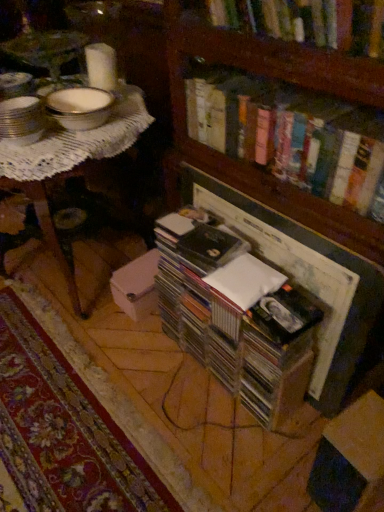
The width and height of the screenshot is (384, 512). What are the coordinates of `wooden bookcase at center` in the screenshot? It's located at (260, 169).

Describe the element at coordinates (349, 455) in the screenshot. The height and width of the screenshot is (512, 384). I see `cardboard box at lower right` at that location.

This screenshot has height=512, width=384. In order to click on cardboard box at lower right in this screenshot , I will do `click(349, 455)`.

Describe the element at coordinates (293, 136) in the screenshot. I see `hardcover books at upper center, marked as the 2th book in a bottom-to-top arrangement` at that location.

At what (x,y) coordinates should I click in order to perform the action: click on wooden bookcase at center. Please return your answer as a coordinate pair (x, y). The image size is (384, 512). Looking at the image, I should click on (260, 169).

Considering the relative sizes of wooden bookcase at center and metallic silver bowls at upper left in the image provided, is wooden bookcase at center wider than metallic silver bowls at upper left?

Yes.

Find the location of a particular element. The height and width of the screenshot is (512, 384). tableware on the left of the wooden bookcase at center is located at coordinates (22, 120).

Who is taller, wooden bookcase at center or metallic silver bowls at upper left?

wooden bookcase at center.

Considering the sizes of objects hardcover books at upper center, marked as the 2th book in a bottom-to-top arrangement, and white lace table at upper left in the image provided, who is smaller, hardcover books at upper center, marked as the 2th book in a bottom-to-top arrangement, or white lace table at upper left?

hardcover books at upper center, marked as the 2th book in a bottom-to-top arrangement, is smaller.

Would you say white lace table at upper left is part of hardcover books at upper center, arranged as the 2th book when viewed from the top,'s contents?

No, white lace table at upper left is located outside of hardcover books at upper center, arranged as the 2th book when viewed from the top.

Consider the image. Considering the relative sizes of hardcover books at upper center, marked as the 2th book in a bottom-to-top arrangement, and white lace table at upper left in the image provided, is hardcover books at upper center, marked as the 2th book in a bottom-to-top arrangement, taller than white lace table at upper left?

No.

Measure the distance from hardcover books at upper center, arranged as the 2th book when viewed from the top, to white lace table at upper left.

A distance of 18.71 inches exists between hardcover books at upper center, arranged as the 2th book when viewed from the top, and white lace table at upper left.

Is cardboard box at lower right placed right next to wooden bookcase at center?

cardboard box at lower right is not next to wooden bookcase at center, and they're not touching.

Does cardboard box at lower right have a greater height compared to wooden bookcase at center?

No, cardboard box at lower right is not taller than wooden bookcase at center.

Which point is more distant from viewer, (379, 443) or (317, 200)?

The point (317, 200) is more distant.

From a real-world perspective, which is physically above, cardboard box at lower right or wooden bookcase at center?

wooden bookcase at center is physically above.

Are cardboard box at lower right and white lace table at upper left located far from each other?

Absolutely, cardboard box at lower right is distant from white lace table at upper left.

In the image, is cardboard box at lower right positioned in front of or behind white lace table at upper left?

Clearly, cardboard box at lower right is in front of white lace table at upper left.

Does cardboard box at lower right contain white lace table at upper left?

Actually, white lace table at upper left is outside cardboard box at lower right.

Which is behind, point (353, 446) or point (127, 134)?

Positioned behind is point (127, 134).

Considering the sizes of white lace table at upper left and metallic silver bowls at upper left in the image, is white lace table at upper left wider or thinner than metallic silver bowls at upper left?

white lace table at upper left is wider than metallic silver bowls at upper left.

Can you confirm if white lace table at upper left is smaller than metallic silver bowls at upper left?

Actually, white lace table at upper left might be larger than metallic silver bowls at upper left.

Could you tell me if white lace table at upper left is facing metallic silver bowls at upper left?

No, white lace table at upper left is not turned towards metallic silver bowls at upper left.

From the image's perspective, does white lace table at upper left appear lower than metallic silver bowls at upper left?

Yes, from the image's perspective, white lace table at upper left is below metallic silver bowls at upper left.

Considering the relative positions of hardcover book at upper center, which is the first book in top-to-bottom order, and hardcover books at upper center, arranged as the 2th book when viewed from the top, in the image provided, is hardcover book at upper center, which is the first book in top-to-bottom order, in front of hardcover books at upper center, arranged as the 2th book when viewed from the top,?

Yes, hardcover book at upper center, which is the first book in top-to-bottom order, is closer to the camera.

Measure the distance between hardcover book at upper center, which ranks as the 3th book in bottom-to-top order, and hardcover books at upper center, marked as the 2th book in a bottom-to-top arrangement.

hardcover book at upper center, which ranks as the 3th book in bottom-to-top order, is 22.55 centimeters from hardcover books at upper center, marked as the 2th book in a bottom-to-top arrangement.

Between hardcover book at upper center, which ranks as the 3th book in bottom-to-top order, and hardcover books at upper center, marked as the 2th book in a bottom-to-top arrangement, which one appears on the right side from the viewer's perspective?

hardcover books at upper center, marked as the 2th book in a bottom-to-top arrangement, is more to the right.

Is hardcover book at upper center, which ranks as the 3th book in bottom-to-top order, next to hardcover books at upper center, arranged as the 2th book when viewed from the top, and touching it?

No, hardcover book at upper center, which ranks as the 3th book in bottom-to-top order, is not making contact with hardcover books at upper center, arranged as the 2th book when viewed from the top.

Is wooden bookcase at center next to white lace table at upper left?

wooden bookcase at center and white lace table at upper left are clearly separated.

Considering the sizes of objects wooden bookcase at center and white lace table at upper left in the image provided, who is shorter, wooden bookcase at center or white lace table at upper left?

Standing shorter between the two is white lace table at upper left.

Is wooden bookcase at center thinner than white lace table at upper left?

Yes.

Find the location of a particular element. Image resolution: width=384 pixels, height=512 pixels. bookcase below the metallic silver bowls at upper left (from a real-world perspective) is located at coordinates (260, 169).

Where is `table on the left of hardcover books at upper center, arranged as the 2th book when viewed from the top`? table on the left of hardcover books at upper center, arranged as the 2th book when viewed from the top is located at coordinates (72, 161).

Looking at the image, which one is located further to clear plastic case at center, which appears as the third book when viewed from the top, hardcover books at upper center, marked as the 2th book in a bottom-to-top arrangement, or hardcover book at upper center, which is the first book in top-to-bottom order?

hardcover book at upper center, which is the first book in top-to-bottom order, is positioned further to the anchor clear plastic case at center, which appears as the third book when viewed from the top.

Which object lies nearer to the anchor point hardcover books at upper center, arranged as the 2th book when viewed from the top, metallic silver bowls at upper left or wooden bookcase at center?

wooden bookcase at center is closer to hardcover books at upper center, arranged as the 2th book when viewed from the top.

Looking at the image, which one is located closer to white lace table at upper left, wooden bookcase at center or clear plastic case at center, which appears as the third book when viewed from the top?

Among the two, wooden bookcase at center is located nearer to white lace table at upper left.

From the image, which object appears to be farther from hardcover book at upper center, which ranks as the 3th book in bottom-to-top order, clear plastic case at center, which appears as the third book when viewed from the top, or wooden bookcase at center?

clear plastic case at center, which appears as the third book when viewed from the top, is positioned further to the anchor hardcover book at upper center, which ranks as the 3th book in bottom-to-top order.

Based on their spatial positions, is metallic silver bowls at upper left or wooden bookcase at center further from cardboard box at lower right?

metallic silver bowls at upper left.

Based on their spatial positions, is cardboard box at lower right or white lace table at upper left closer to hardcover book at upper center, which ranks as the 3th book in bottom-to-top order?

white lace table at upper left is positioned closer to the anchor hardcover book at upper center, which ranks as the 3th book in bottom-to-top order.

Considering their positions, is clear plastic case at center, which appears as the third book when viewed from the top, positioned closer to wooden bookcase at center than white lace table at upper left?

Among the two, clear plastic case at center, which appears as the third book when viewed from the top, is located nearer to wooden bookcase at center.

When comparing their distances from hardcover book at upper center, which is the first book in top-to-bottom order, does metallic silver bowls at upper left or cardboard box at lower right seem further?

cardboard box at lower right.

At what (x,y) coordinates should I click in order to perform the action: click on table between hardcover book at upper center, which is the first book in top-to-bottom order, and clear plastic case at center, which is the 1th book in bottom-to-top order, from top to bottom. Please return your answer as a coordinate pair (x, y). This screenshot has width=384, height=512. Looking at the image, I should click on (72, 161).

The width and height of the screenshot is (384, 512). I want to click on tableware between hardcover book at upper center, which is the first book in top-to-bottom order, and clear plastic case at center, which appears as the third book when viewed from the top, in the vertical direction, so click(22, 120).

The width and height of the screenshot is (384, 512). Identify the location of book between hardcover book at upper center, which ranks as the 3th book in bottom-to-top order, and clear plastic case at center, which is the 1th book in bottom-to-top order, in the vertical direction. (293, 136).

Locate an element on the screen. The width and height of the screenshot is (384, 512). bookcase between metallic silver bowls at upper left and cardboard box at lower right in the horizontal direction is located at coordinates (260, 169).